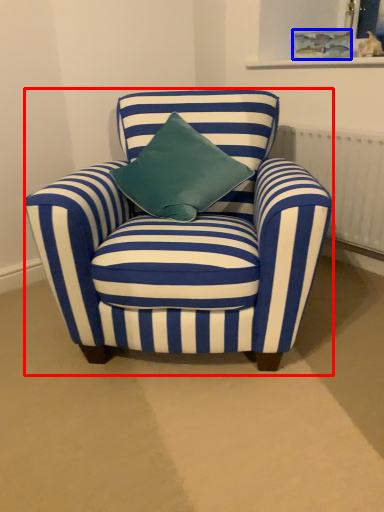
Question: Which object appears closest to the camera in this image, chair (highlighted by a red box) or picture frame (highlighted by a blue box)?

Choices:
 (A) chair
 (B) picture frame

Answer: (A)